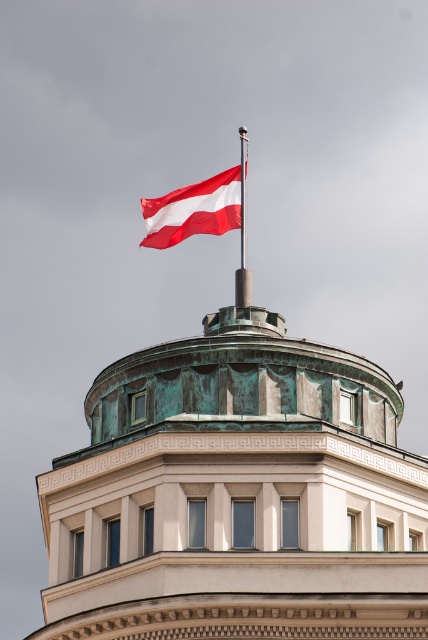
Does red fabric flag at upper center appear on the right side of red flagpole at top?

Incorrect, red fabric flag at upper center is not on the right side of red flagpole at top.

Is red fabric flag at upper center shorter than red flagpole at top?

Yes, red fabric flag at upper center is shorter than red flagpole at top.

Between point (146, 204) and point (244, 253), which one is positioned behind?

The point (244, 253) is behind.

Locate an element on the screen. red fabric flag at upper center is located at coordinates click(195, 209).